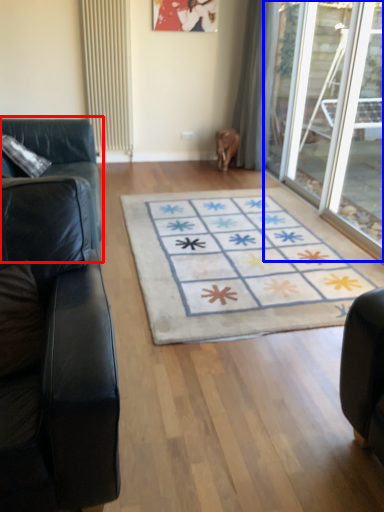
Question: Which object appears closest to the camera in this image, studio couch (highlighted by a red box) or glass door (highlighted by a blue box)?

Choices:
 (A) studio couch
 (B) glass door

Answer: (A)